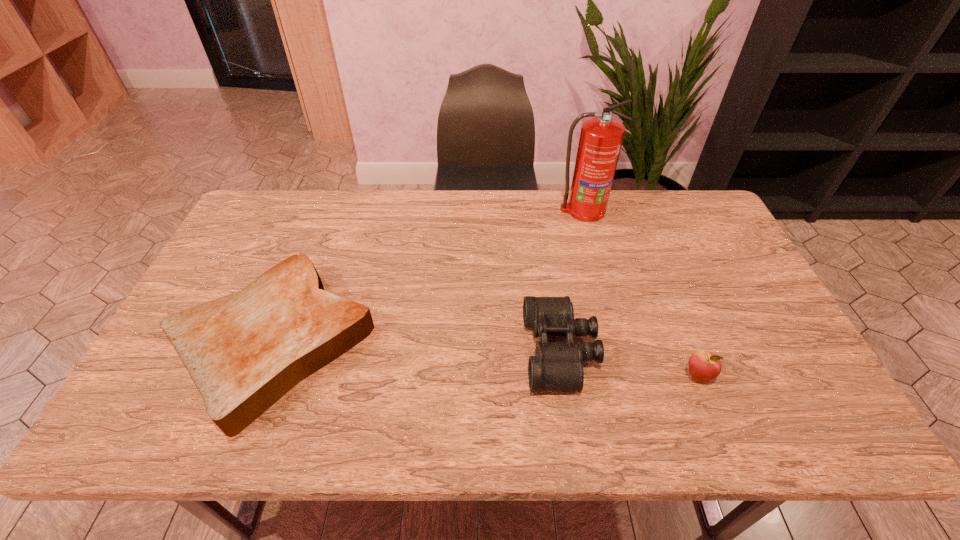
Locate an element on the screen. Image resolution: width=960 pixels, height=540 pixels. vacant area that lies between the tallest object and the apple is located at coordinates (640, 293).

Image resolution: width=960 pixels, height=540 pixels. In order to click on object that stands as the second closest to the shortest object in this screenshot , I will do `click(601, 137)`.

Locate which object ranks third in proximity to the binoculars. Please provide its 2D coordinates. Your answer should be formatted as a tuple, i.e. [(x, y)], where the tuple contains the x and y coordinates of a point satisfying the conditions above.

[(244, 351)]

Where is `vacant space that satisfies the following two spatial constraints: 1. on the instruction side of the fire extinguisher; 2. at the eyepieces of the binoculars`? vacant space that satisfies the following two spatial constraints: 1. on the instruction side of the fire extinguisher; 2. at the eyepieces of the binoculars is located at coordinates (620, 351).

You are a GUI agent. You are given a task and a screenshot of the screen. Output one action in this format:
    pyautogui.click(x=<x>, y=<y>)
    Task: Click on the free point that satisfies the following two spatial constraints: 1. on the instruction side of the rightmost object; 2. on the right side of the fire extinguisher
    This screenshot has height=540, width=960.
    Given the screenshot: What is the action you would take?
    pyautogui.click(x=627, y=376)

The height and width of the screenshot is (540, 960). I want to click on free space that satisfies the following two spatial constraints: 1. on the instruction side of the rightmost object; 2. on the right side of the fire extinguisher, so click(x=627, y=376).

Find the location of a particular element. free location that satisfies the following two spatial constraints: 1. on the instruction side of the fire extinguisher; 2. on the right side of the apple is located at coordinates (627, 376).

Find the location of a particular element. The image size is (960, 540). blank area in the image that satisfies the following two spatial constraints: 1. on the front side of the bread; 2. on the left side of the apple is located at coordinates (260, 376).

You are a GUI agent. You are given a task and a screenshot of the screen. Output one action in this format:
    pyautogui.click(x=<x>, y=<y>)
    Task: Click on the vacant space that satisfies the following two spatial constraints: 1. at the eyepieces of the binoculars; 2. on the back side of the apple
    
    Given the screenshot: What is the action you would take?
    pyautogui.click(x=564, y=376)

Locate an element on the screen. This screenshot has width=960, height=540. vacant point that satisfies the following two spatial constraints: 1. at the eyepieces of the binoculars; 2. on the left side of the apple is located at coordinates (564, 376).